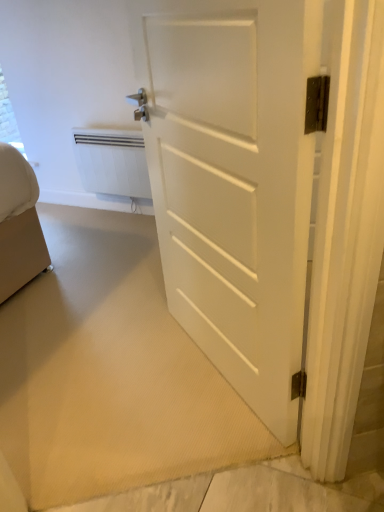
Question: Relative to white matte door at center, is white matte radiator at upper left in front or behind?

Choices:
 (A) behind
 (B) front

Answer: (A)

Question: Considering the positions of white matte radiator at upper left and white matte door at center in the image, is white matte radiator at upper left taller or shorter than white matte door at center?

Choices:
 (A) tall
 (B) short

Answer: (B)

Question: From a real-world perspective, is white matte radiator at upper left physically located above or below white matte door at center?

Choices:
 (A) below
 (B) above

Answer: (A)

Question: From the image's perspective, is white matte door at center above or below white matte radiator at upper left?

Choices:
 (A) above
 (B) below

Answer: (B)

Question: Is point (256, 309) closer or farther from the camera than point (94, 187)?

Choices:
 (A) closer
 (B) farther

Answer: (A)

Question: In the image, is white matte door at center positioned in front of or behind white matte radiator at upper left?

Choices:
 (A) front
 (B) behind

Answer: (A)

Question: From a real-world perspective, is white matte door at center physically located above or below white matte radiator at upper left?

Choices:
 (A) above
 (B) below

Answer: (A)